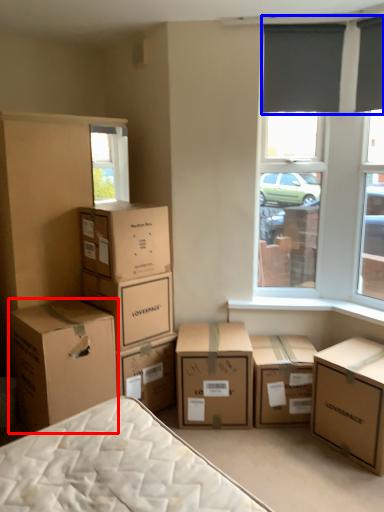
Question: Which point is closer to the camera, box (highlighted by a red box) or curtain (highlighted by a blue box)?

Choices:
 (A) box
 (B) curtain

Answer: (A)